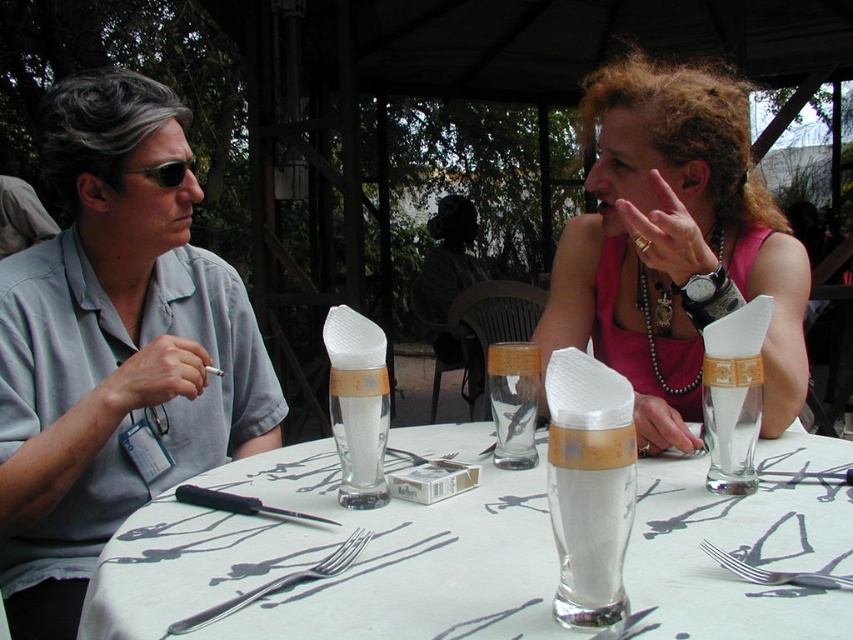
You are standing at the edge of the table and want to reach both the point at coordinates point (309, 577) and the point at coordinates point (746, 568). Which point is closer to you?

Point (746, 568) is closer to you because it is in front of point (309, 577), which is behind it.

You are a fashion designer observing two outfits in the image. The outfits belong to two people sitting at a round table. Which outfit is thinner between the gray cotton shirt at left and the pink fabric dress at upper right?

The gray cotton shirt at left is thinner than the pink fabric dress at upper right.